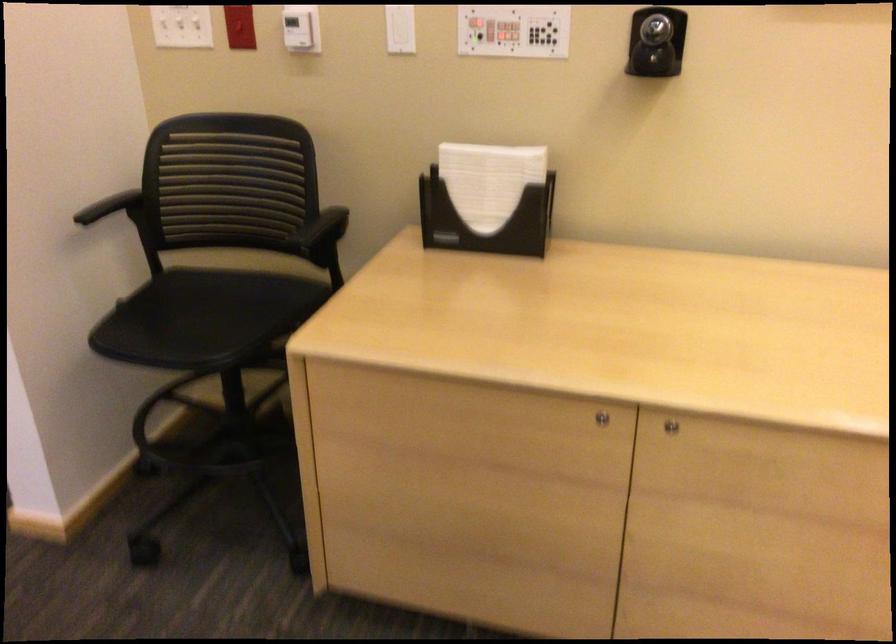
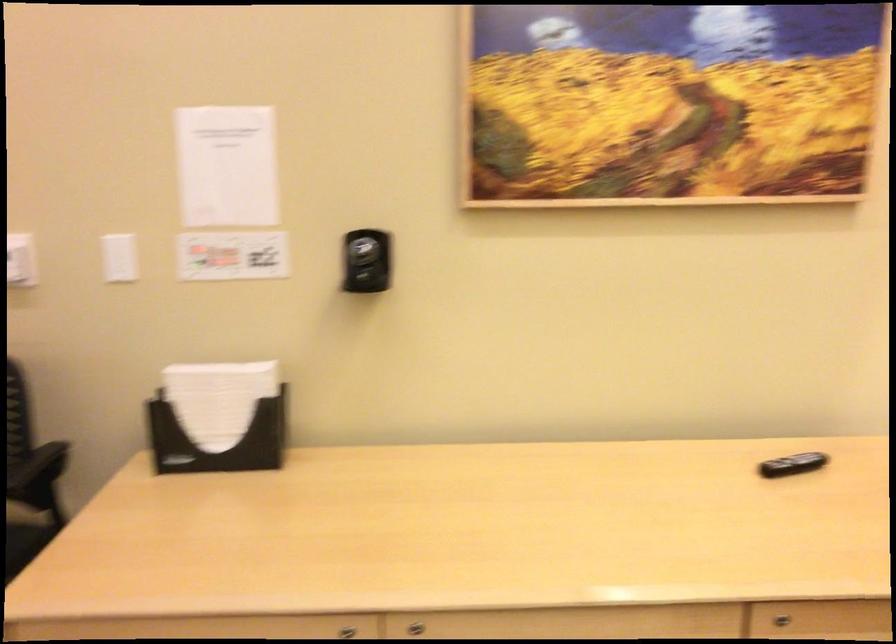
Question: The images are taken continuously from a first-person perspective. In which direction are you moving?

Choices:
 (A) Left
 (B) Right
 (C) Forward
 (D) Backward

Answer: (B)